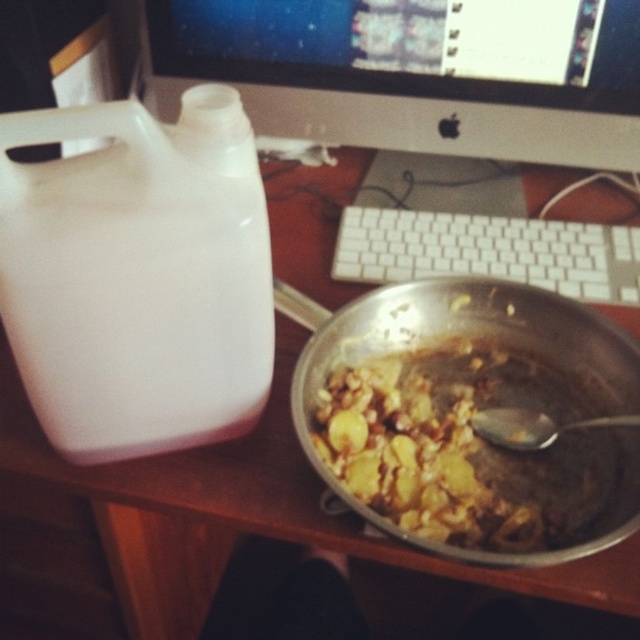
Between golden brown textured food at center and metallic spoon at bowl right, which one appears on the left side from the viewer's perspective?

golden brown textured food at center is more to the left.

Is point (412, 532) farther from camera compared to point (481, 416)?

No, (412, 532) is in front of (481, 416).

Find the location of a particular element. Image resolution: width=640 pixels, height=640 pixels. golden brown textured food at center is located at coordinates click(x=465, y=445).

Measure the distance between white plastic monitor at upper center and metallic spoon at bowl right.

white plastic monitor at upper center is 16.32 inches away from metallic spoon at bowl right.

Can you confirm if white plastic monitor at upper center is shorter than metallic spoon at bowl right?

Incorrect, white plastic monitor at upper center's height does not fall short of metallic spoon at bowl right's.

Between point (444, 54) and point (593, 422), which one is positioned in front?

Positioned in front is point (593, 422).

Where is `white plastic monitor at upper center`? white plastic monitor at upper center is located at coordinates (417, 72).

Can you confirm if white plastic monitor at upper center is positioned to the left of white plastic keyboard at center?

Correct, you'll find white plastic monitor at upper center to the left of white plastic keyboard at center.

Between white plastic monitor at upper center and white plastic keyboard at center, which one has less height?

With less height is white plastic keyboard at center.

Who is more forward, (326,77) or (420,221)?

Point (326,77) is more forward.

Where is `white plastic monitor at upper center`? Image resolution: width=640 pixels, height=640 pixels. white plastic monitor at upper center is located at coordinates (417, 72).